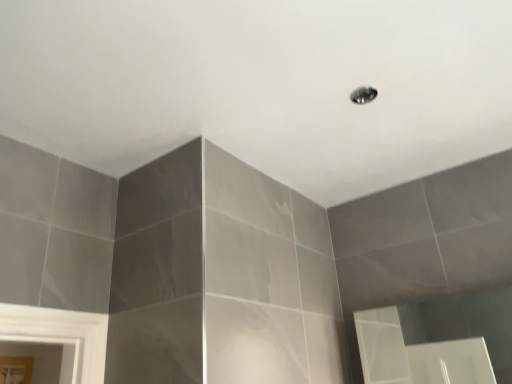
The image size is (512, 384). Describe the element at coordinates (362, 95) in the screenshot. I see `satin chrome shower at upper center` at that location.

Measure the distance between point (370, 94) and camera.

They are 1.42 meters apart.

What are the coordinates of `satin chrome shower at upper center` in the screenshot? It's located at (362, 95).

Locate an element on the screen. satin chrome shower at upper center is located at coordinates (362, 95).